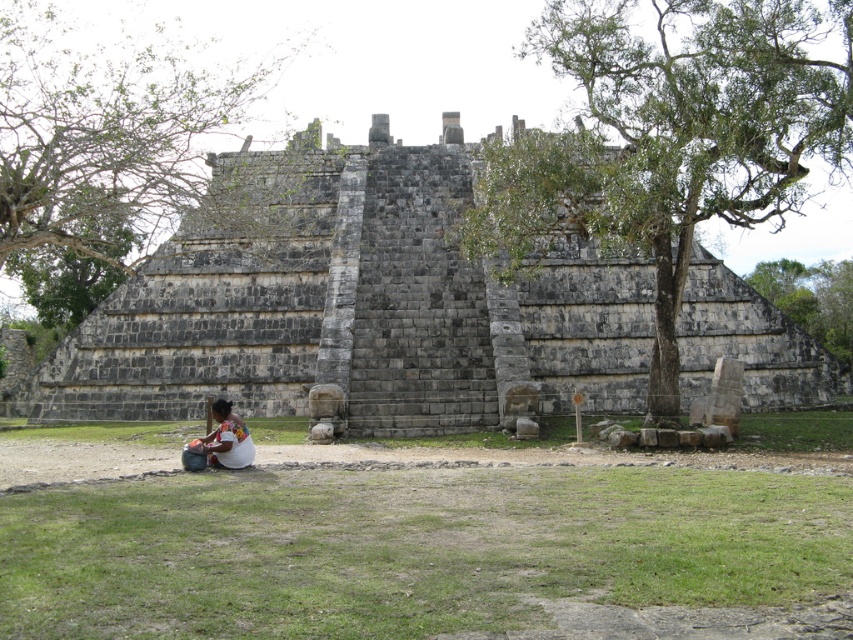
Does point (407, 320) lie behind point (566, 529)?

Yes.

Can you confirm if gray stone ruins at center is bigger than green grass at lower center?

Correct, gray stone ruins at center is larger in size than green grass at lower center.

Where is `gray stone ruins at center`? gray stone ruins at center is located at coordinates (354, 310).

Between point (386, 304) and point (207, 440), which one is positioned behind?

Point (386, 304)

Is point (370, 214) farther from viewer compared to point (224, 465)?

Yes, it is behind point (224, 465).

Is point (648, 394) farther from camera compared to point (250, 458)?

Yes.

Locate an element on the screen. This screenshot has width=853, height=640. gray stone ruins at center is located at coordinates (354, 310).

Can you confirm if green grass at lower center is thinner than multicolored fabric at lower left?

No.

Does green grass at lower center have a lesser height compared to multicolored fabric at lower left?

Indeed, green grass at lower center has a lesser height compared to multicolored fabric at lower left.

Which is in front, point (753, 534) or point (222, 451)?

Point (753, 534) is more forward.

This screenshot has width=853, height=640. I want to click on green grass at lower center, so click(409, 548).